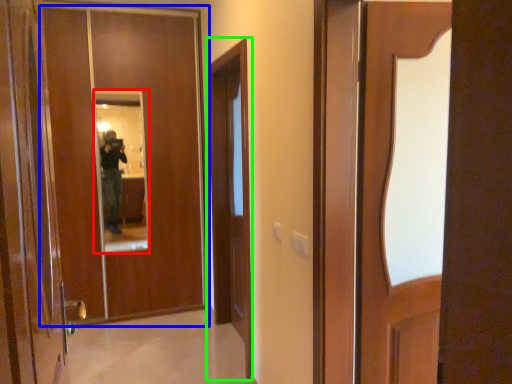
Question: Estimate the real-world distances between objects in this image. Which object is closer to mirror (highlighted by a red box), door (highlighted by a blue box) or screen door (highlighted by a green box)?

Choices:
 (A) door
 (B) screen door

Answer: (A)